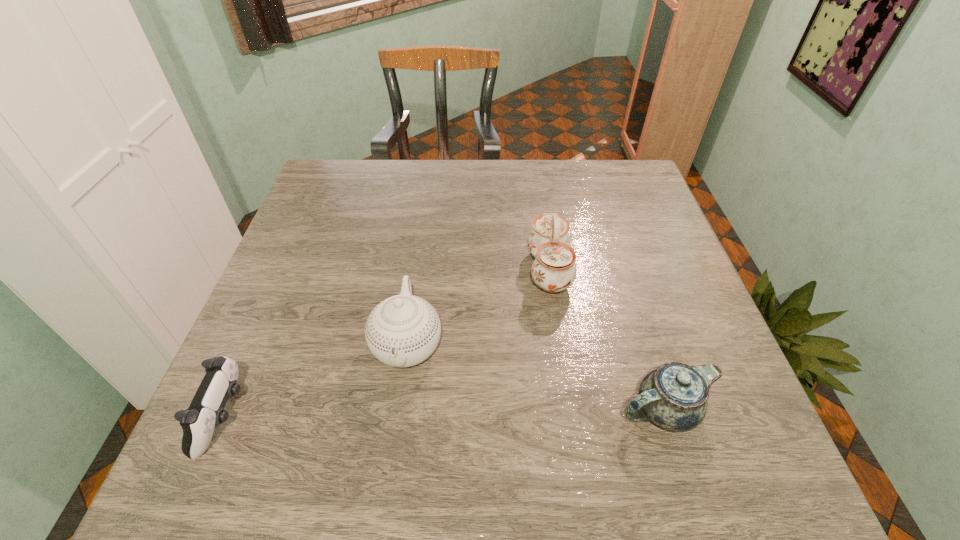
Locate an element on the screen. The height and width of the screenshot is (540, 960). the farthest object is located at coordinates (554, 269).

Identify the location of the second chinaware from left to right. (554, 269).

Image resolution: width=960 pixels, height=540 pixels. What are the coordinates of `the second object from left to right` in the screenshot? It's located at (401, 331).

Find the location of a particular element. the shortest chinaware is located at coordinates (674, 397).

This screenshot has height=540, width=960. Identify the location of the rightmost chinaware. (674, 397).

Identify the location of control. (206, 411).

Identify the location of blank area located 0.240m by the handle of the farthest object. (425, 270).

Identify the location of free space located by the handle of the farthest object. This screenshot has height=540, width=960. click(404, 270).

Identify the location of free space located by the handle of the farthest object. (446, 270).

Find the location of `vacant point located 0.070m on the spout of the leftmost chinaware`. vacant point located 0.070m on the spout of the leftmost chinaware is located at coordinates (396, 425).